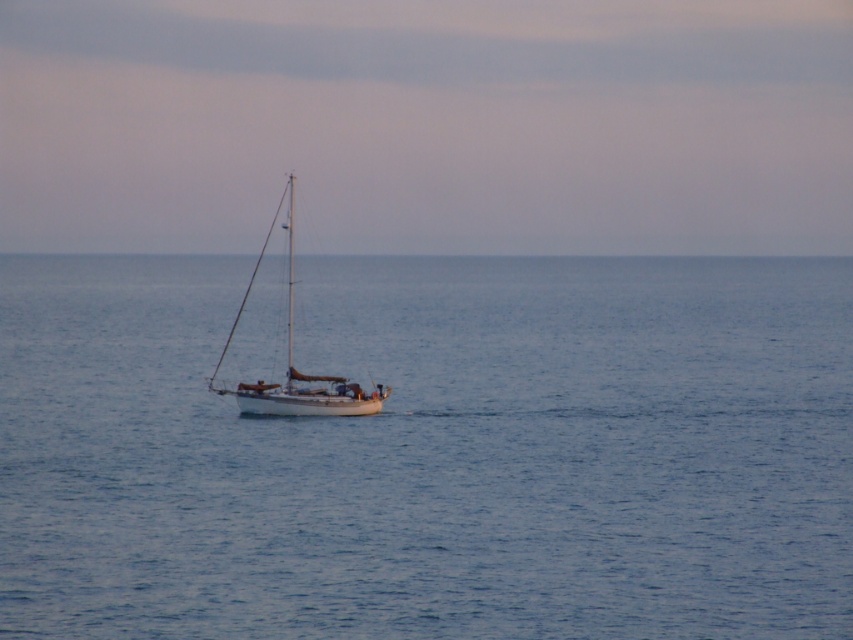
You are a photographer planning to take a photo of the white matte sailboat at center and the blue water at center. Based on the scene, which object occupies a larger portion of the image horizontally?

The blue water at center might be wider than white matte sailboat at center, so the blue water at center likely occupies a larger horizontal portion in the image.

You are a photographer planning to capture a wide shot of the blue water at center and the white matte sailboat at center. Based on the scene, which object will occupy more space in your photo?

The blue water at center occupies more space in the photo because it is described as bigger than the white matte sailboat at center.

You are standing on the deck of the sailboat and want to reach both the point at coordinates point (695, 289) and point (376, 403). Which point is closer to you?

Point (376, 403) is closer to you because it is less further to the viewer than point (695, 289).